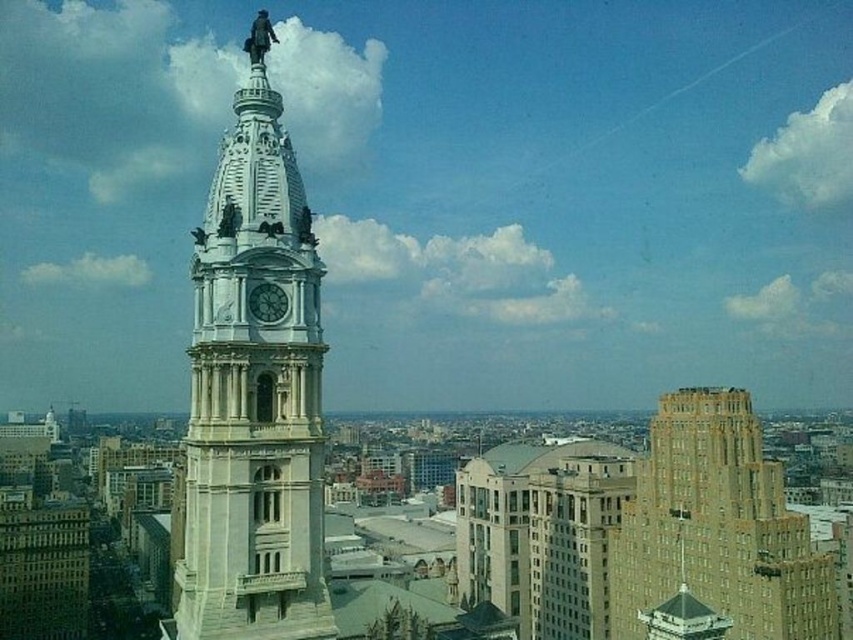
Does white stone clock tower at center have a smaller size compared to white marble clock at center?

Incorrect, white stone clock tower at center is not smaller in size than white marble clock at center.

What do you see at coordinates (254, 392) in the screenshot?
I see `white stone clock tower at center` at bounding box center [254, 392].

Describe the element at coordinates (254, 392) in the screenshot. I see `white stone clock tower at center` at that location.

You are a GUI agent. You are given a task and a screenshot of the screen. Output one action in this format:
    pyautogui.click(x=<x>, y=<y>)
    Task: Click on the white stone clock tower at center
    
    Given the screenshot: What is the action you would take?
    pyautogui.click(x=254, y=392)

Does brown brick building at center-right appear on the left side of white marble clock at center?

In fact, brown brick building at center-right is to the right of white marble clock at center.

Does brown brick building at center-right appear on the right side of white marble clock at center?

Indeed, brown brick building at center-right is positioned on the right side of white marble clock at center.

Who is more forward, [820,561] or [280,308]?

Point [280,308]

You are a GUI agent. You are given a task and a screenshot of the screen. Output one action in this format:
    pyautogui.click(x=<x>, y=<y>)
    Task: Click on the brown brick building at center-right
    The width and height of the screenshot is (853, 640).
    Given the screenshot: What is the action you would take?
    pyautogui.click(x=717, y=528)

Does white stone clock tower at center have a lesser height compared to brown brick building at center-right?

Incorrect, white stone clock tower at center's height does not fall short of brown brick building at center-right's.

Can you confirm if white stone clock tower at center is positioned to the right of brown brick building at center-right?

Incorrect, white stone clock tower at center is not on the right side of brown brick building at center-right.

Is point (200, 605) closer to camera compared to point (714, 548)?

Yes, point (200, 605) is in front of point (714, 548).

Locate an element on the screen. The width and height of the screenshot is (853, 640). white stone clock tower at center is located at coordinates (254, 392).